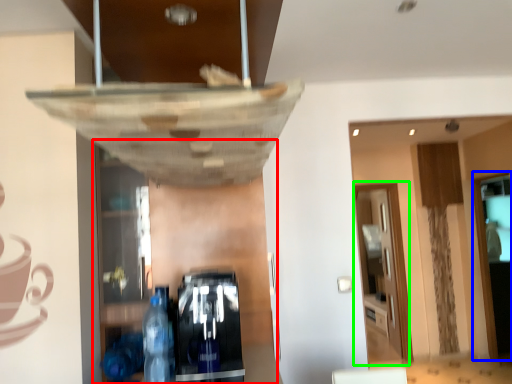
Question: Estimate the real-world distances between objects in this image. Which object is farther from shelf (highlighted by a red box), glass door (highlighted by a blue box) or glass door (highlighted by a green box)?

Choices:
 (A) glass door
 (B) glass door

Answer: (B)